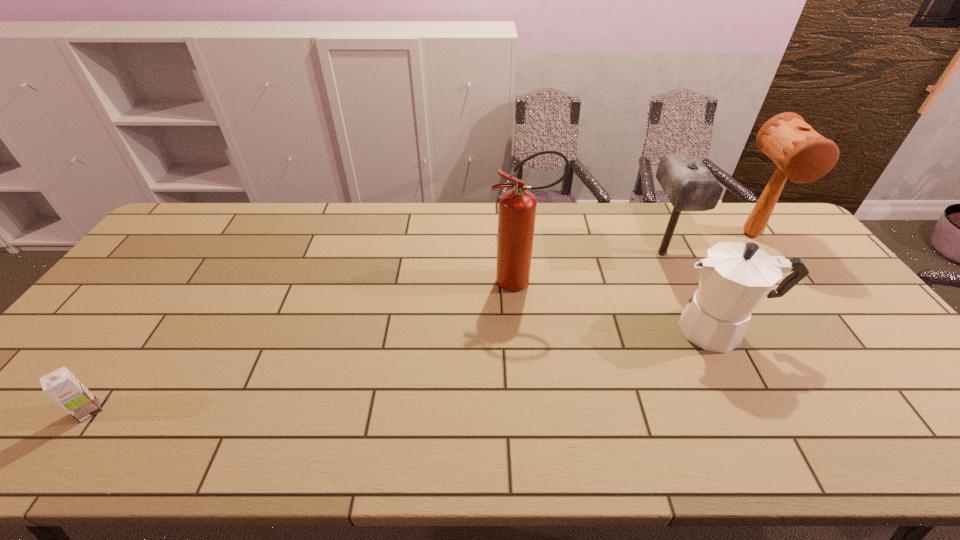
You are a GUI agent. You are given a task and a screenshot of the screen. Output one action in this format:
    pyautogui.click(x=<x>, y=<y>)
    Task: Click on the object that is positioned at the far right corner
    This screenshot has height=540, width=960.
    Given the screenshot: What is the action you would take?
    pyautogui.click(x=802, y=155)

This screenshot has height=540, width=960. I want to click on free space at the far edge of the desktop, so click(x=613, y=206).

Where is `vacant area at the near edge of the desktop`? The width and height of the screenshot is (960, 540). vacant area at the near edge of the desktop is located at coordinates (880, 452).

The height and width of the screenshot is (540, 960). In the image, there is a desktop. What are the coordinates of `free space at the left edge` in the screenshot? It's located at (117, 340).

Identify the location of free space at the right edge. (794, 246).

Locate an element on the screen. This screenshot has height=540, width=960. vacant space at the far left corner of the desktop is located at coordinates (208, 234).

You are a GUI agent. You are given a task and a screenshot of the screen. Output one action in this format:
    pyautogui.click(x=<x>, y=<y>)
    Task: Click on the vacant area that lies between the leftmost object and the second object from left to right
    The height and width of the screenshot is (540, 960).
    Given the screenshot: What is the action you would take?
    pyautogui.click(x=305, y=346)

At what (x,y) coordinates should I click in order to perform the action: click on free space that is in between the right mallet and the left mallet. Please return your answer as a coordinate pair (x, y). Image resolution: width=960 pixels, height=540 pixels. Looking at the image, I should click on (707, 243).

Find the location of `vacant point located between the second object from left to right and the rightmost object`. vacant point located between the second object from left to right and the rightmost object is located at coordinates (636, 258).

Locate an element on the screen. empty space that is in between the fourth object from right to left and the rightmost object is located at coordinates (636, 258).